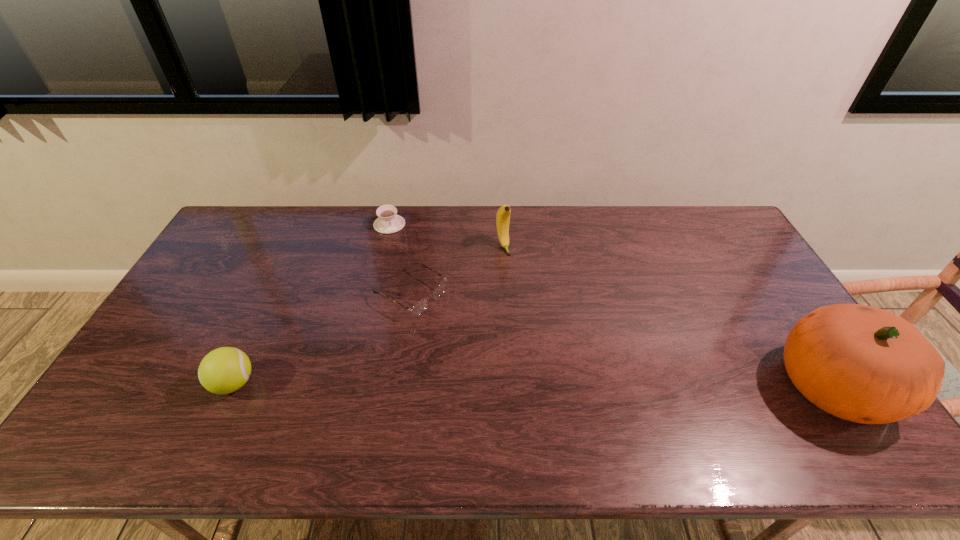
This screenshot has height=540, width=960. In order to click on free space between the third farthest object and the tallest object in this screenshot , I will do `click(622, 340)`.

The height and width of the screenshot is (540, 960). In order to click on vacant point located between the tennis ball and the rightmost object in this screenshot , I will do `click(534, 384)`.

Identify the location of unoccupied area between the third farthest object and the banana. (457, 270).

You are a GUI agent. You are given a task and a screenshot of the screen. Output one action in this format:
    pyautogui.click(x=<x>, y=<y>)
    Task: Click on the vacant region between the teacup and the spectacles
    The height and width of the screenshot is (540, 960).
    Given the screenshot: What is the action you would take?
    coord(400,259)

The image size is (960, 540). I want to click on free point between the third farthest object and the tallest object, so click(x=622, y=340).

In order to click on vacant space that is in between the rightmost object and the second tallest object in this screenshot , I will do `click(668, 316)`.

This screenshot has width=960, height=540. I want to click on free area in between the tennis ball and the spectacles, so click(323, 339).

Locate an element on the screen. free spot between the teacup and the rightmost object is located at coordinates (612, 305).

Find the location of a particular element. Image resolution: width=960 pixels, height=540 pixels. free spot between the farthest object and the third nearest object is located at coordinates (400, 259).

The width and height of the screenshot is (960, 540). What are the coordinates of `vacant region between the second object from right to left and the teacup` in the screenshot? It's located at (446, 235).